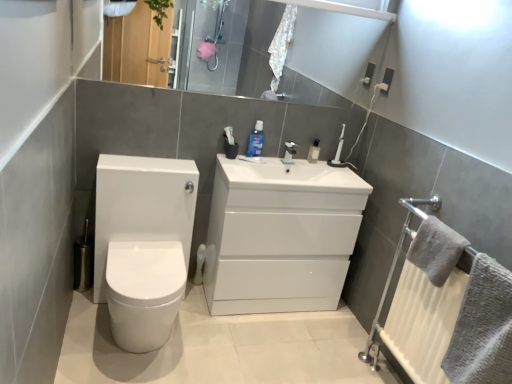
Question: Is white glossy toilet at left further to camera compared to glossy white mirror at upper center?

Choices:
 (A) yes
 (B) no

Answer: (B)

Question: Considering the relative positions of white glossy toilet at left and glossy white mirror at upper center in the image provided, is white glossy toilet at left in front of glossy white mirror at upper center?

Choices:
 (A) yes
 (B) no

Answer: (A)

Question: Does white glossy toilet at left have a larger size compared to glossy white mirror at upper center?

Choices:
 (A) yes
 (B) no

Answer: (A)

Question: From the image's perspective, is white glossy toilet at left below glossy white mirror at upper center?

Choices:
 (A) yes
 (B) no

Answer: (A)

Question: Can you confirm if white glossy toilet at left is thinner than glossy white mirror at upper center?

Choices:
 (A) yes
 (B) no

Answer: (B)

Question: Does point (212, 201) appear closer or farther from the camera than point (446, 261)?

Choices:
 (A) farther
 (B) closer

Answer: (A)

Question: In terms of size, does white glossy cabinet at center appear bigger or smaller than gray fluffy towel at right, placed as the second bath towel when sorted from bottom to top?

Choices:
 (A) small
 (B) big

Answer: (B)

Question: From the image's perspective, relative to gray fluffy towel at right, the 1th bath towel positioned from the top, is white glossy cabinet at center above or below?

Choices:
 (A) below
 (B) above

Answer: (A)

Question: In terms of height, does white glossy cabinet at center look taller or shorter compared to gray fluffy towel at right, the 1th bath towel positioned from the top?

Choices:
 (A) tall
 (B) short

Answer: (A)

Question: Is gray fluffy towel at right, the 1th bath towel positioned from the top, inside or outside of white glossy cabinet at center?

Choices:
 (A) outside
 (B) inside

Answer: (A)

Question: From the image's perspective, is gray fluffy towel at right, the 1th bath towel positioned from the top, above or below white glossy cabinet at center?

Choices:
 (A) below
 (B) above

Answer: (B)

Question: From a real-world perspective, is gray fluffy towel at right, placed as the second bath towel when sorted from bottom to top, positioned above or below white glossy cabinet at center?

Choices:
 (A) below
 (B) above

Answer: (B)

Question: In the image, is gray fluffy towel at right, placed as the second bath towel when sorted from bottom to top, positioned in front of or behind white glossy cabinet at center?

Choices:
 (A) front
 (B) behind

Answer: (A)

Question: Is point (414, 238) closer or farther from the camera than point (290, 77)?

Choices:
 (A) farther
 (B) closer

Answer: (B)

Question: Looking at the image, does gray fluffy towel at right, placed as the second bath towel when sorted from bottom to top, seem bigger or smaller compared to glossy white mirror at upper center?

Choices:
 (A) small
 (B) big

Answer: (A)